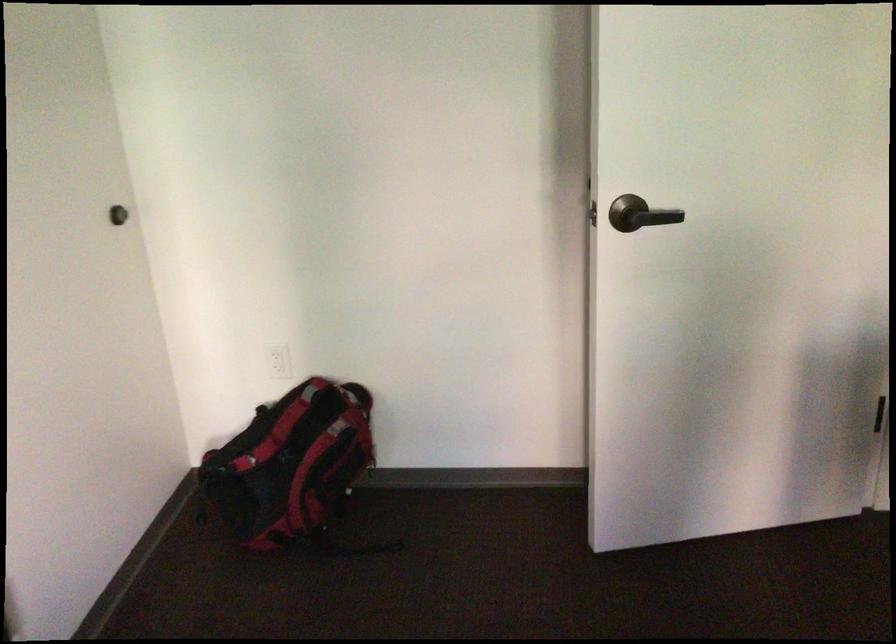
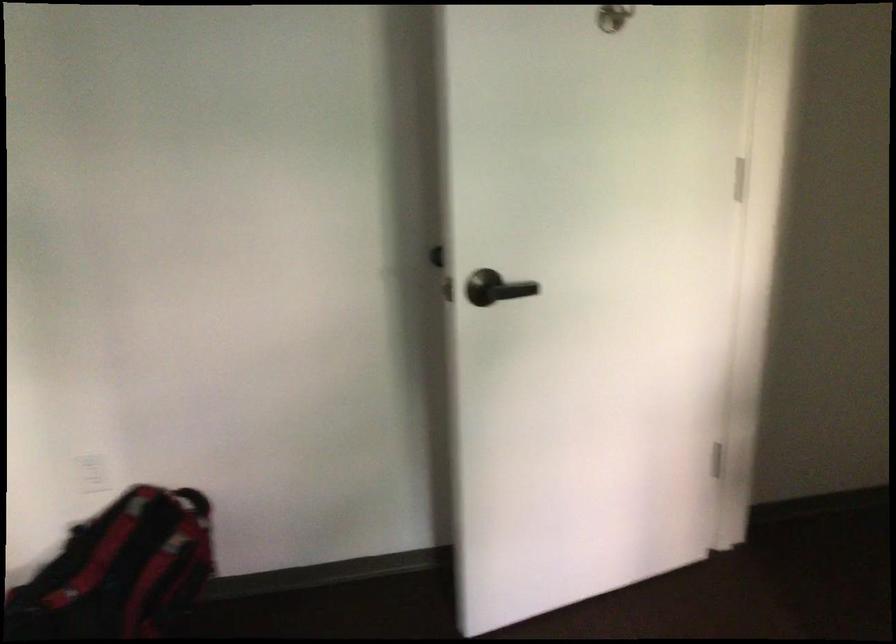
Question: How did the camera likely rotate?

Choices:
 (A) Left
 (B) Right
 (C) Up
 (D) Down

Answer: (B)